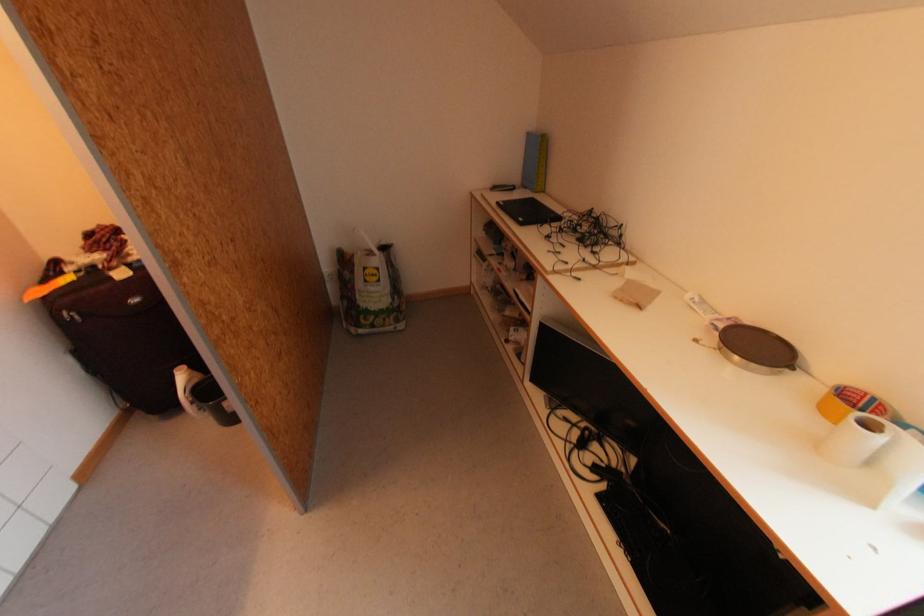
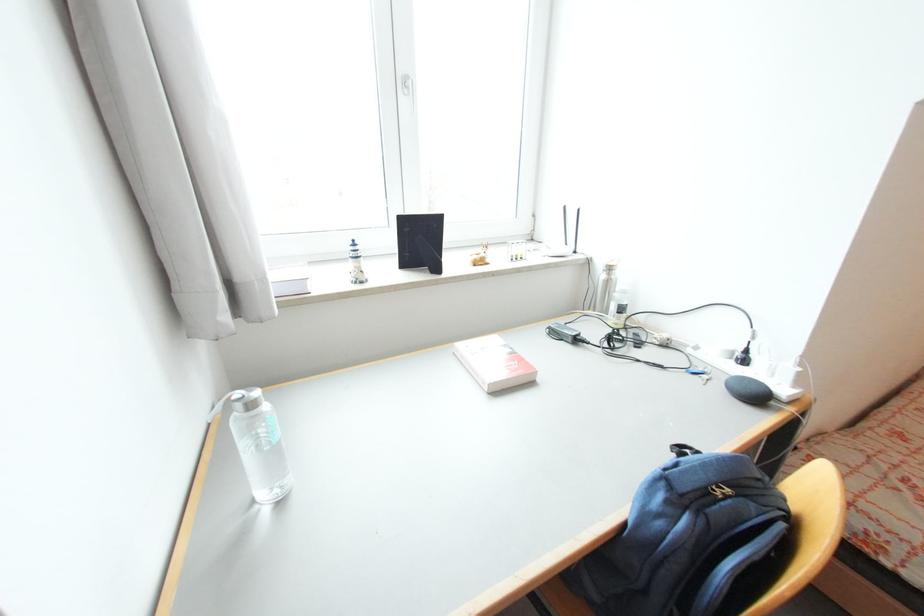
First-person continuous shooting, in which direction is the camera rotating?

The camera's rotation is toward right-down.